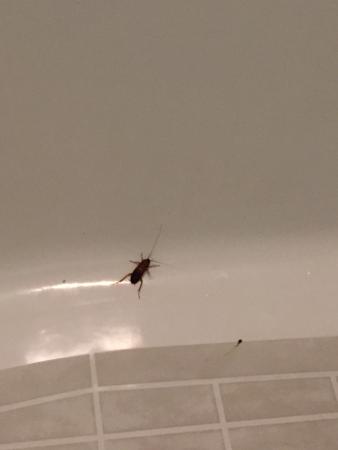
You are a GUI agent. You are given a task and a screenshot of the screen. Output one action in this format:
    pyautogui.click(x=<x>, y=<y>)
    Task: Click on the ceramic tub
    This screenshot has width=338, height=450.
    Given the screenshot: What is the action you would take?
    pyautogui.click(x=213, y=321)